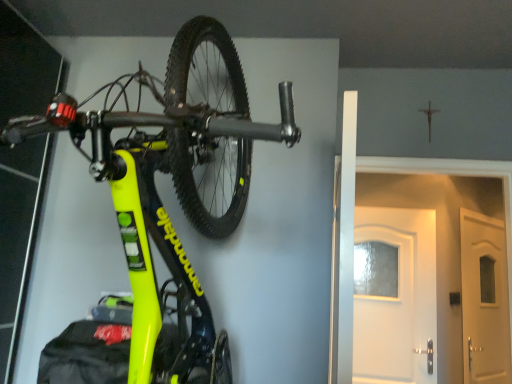
Question: Would you say white matte door at center is inside or outside neon yellow matte bicycle at upper left?

Choices:
 (A) outside
 (B) inside

Answer: (A)

Question: In terms of height, does white matte door at center look taller or shorter compared to neon yellow matte bicycle at upper left?

Choices:
 (A) short
 (B) tall

Answer: (A)

Question: Is point (473, 165) closer or farther from the camera than point (198, 57)?

Choices:
 (A) farther
 (B) closer

Answer: (A)

Question: Would you say neon yellow matte bicycle at upper left is to the left or to the right of white matte door at center in the picture?

Choices:
 (A) right
 (B) left

Answer: (B)

Question: Do you think neon yellow matte bicycle at upper left is within white matte door at center, or outside of it?

Choices:
 (A) outside
 (B) inside

Answer: (A)

Question: Considering their positions, is neon yellow matte bicycle at upper left located in front of or behind white matte door at center?

Choices:
 (A) front
 (B) behind

Answer: (A)

Question: Considering the positions of point (154, 226) and point (339, 296), is point (154, 226) closer or farther from the camera than point (339, 296)?

Choices:
 (A) closer
 (B) farther

Answer: (A)